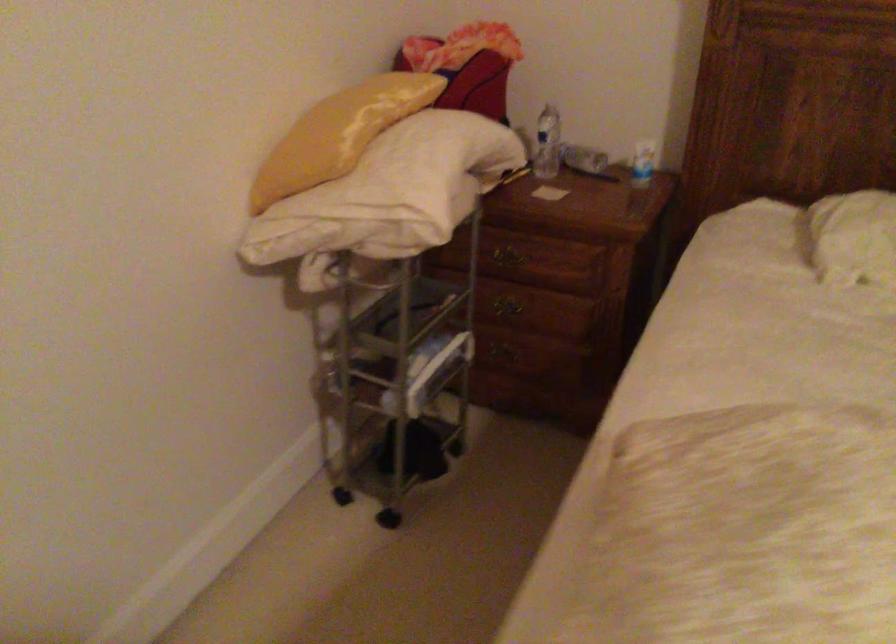
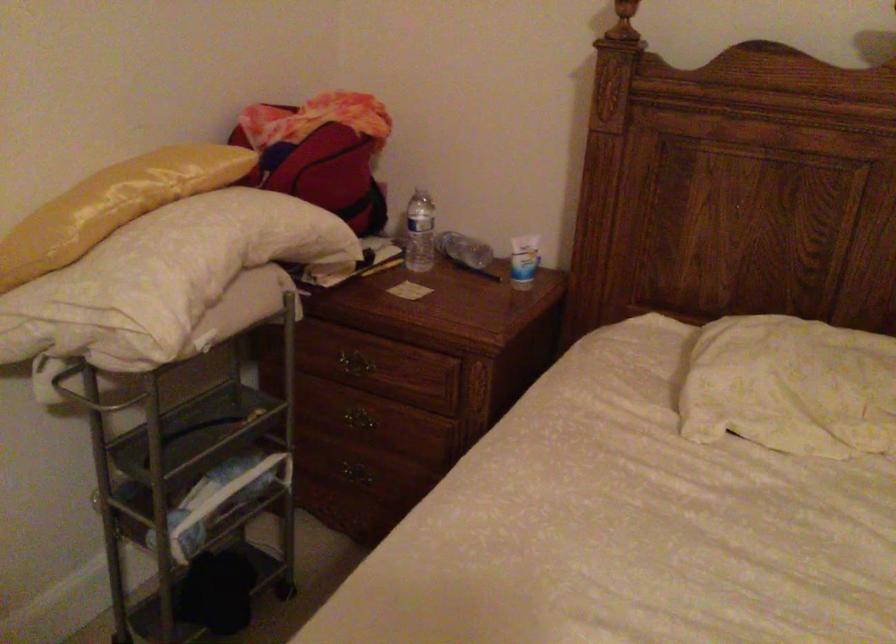
In the second image, find the point that corresponds to point (504, 261) in the first image.

(350, 365)